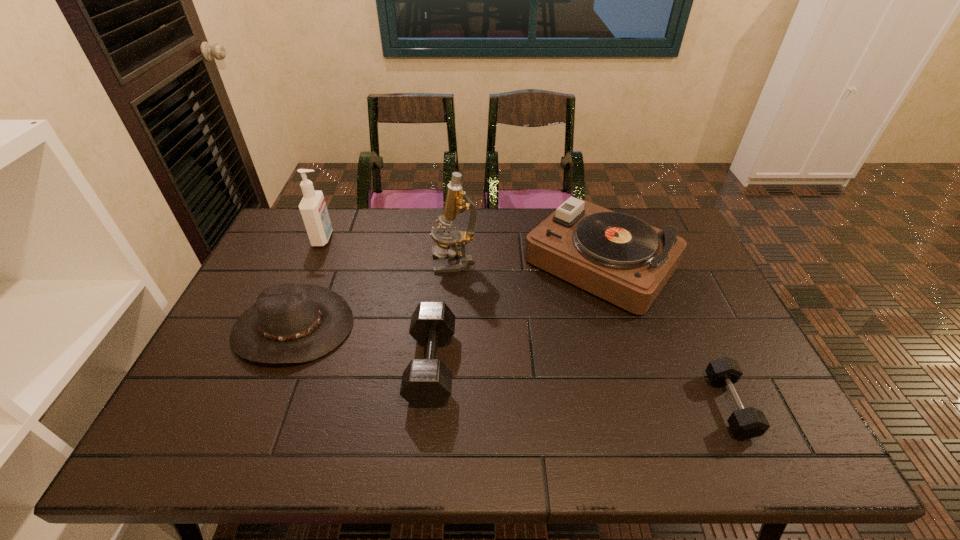
This screenshot has height=540, width=960. I want to click on dumbbell present at the right edge, so click(747, 423).

Where is `object located at the far left corner`? Image resolution: width=960 pixels, height=540 pixels. object located at the far left corner is located at coordinates (313, 209).

Where is `object located at the far right corner`? Image resolution: width=960 pixels, height=540 pixels. object located at the far right corner is located at coordinates (620, 258).

Identify the location of object that is at the near right corner. click(x=747, y=423).

Image resolution: width=960 pixels, height=540 pixels. Find the location of `vacant space at the far edge of the desktop`. vacant space at the far edge of the desktop is located at coordinates (503, 230).

Locate an element on the screen. vacant region at the near edge is located at coordinates 389,430.

The height and width of the screenshot is (540, 960). In the image, there is a desktop. Find the location of `free region at the left edge`. free region at the left edge is located at coordinates (236, 320).

In the image, there is a desktop. Where is `vacant space at the right edge`? vacant space at the right edge is located at coordinates (711, 305).

You are a GUI agent. You are given a task and a screenshot of the screen. Output one action in this format:
    pyautogui.click(x=<x>, y=<y>)
    Task: Click on the vacant space at the near left corner
    This screenshot has height=540, width=960.
    Given the screenshot: What is the action you would take?
    pyautogui.click(x=185, y=453)

Image resolution: width=960 pixels, height=540 pixels. Identify the location of free space at the far right corner of the desktop. (685, 235).